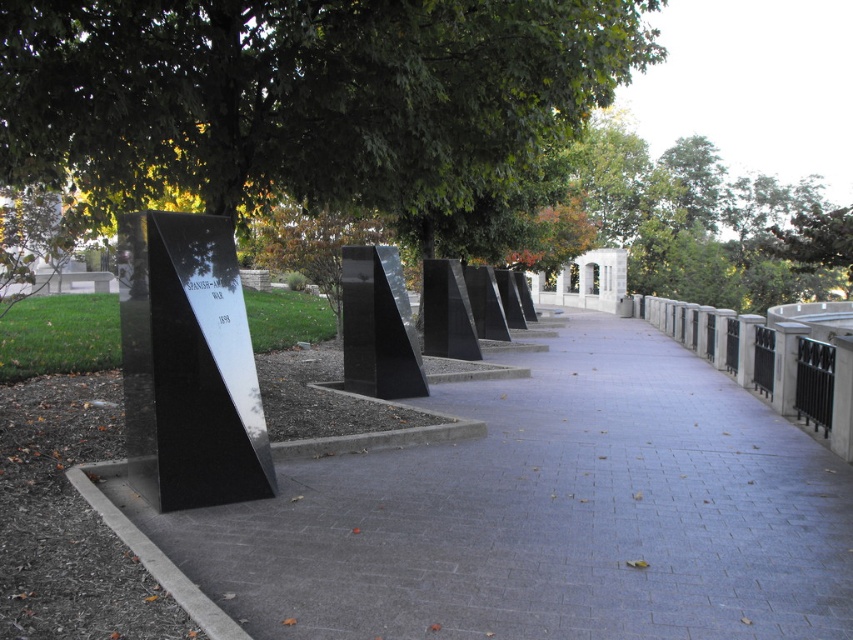
Question: Estimate the real-world distances between objects in this image. Which object is farther from the green leafy tree at upper center?

Choices:
 (A) black polished stone monument at center
 (B) gray concrete pavement at center

Answer: (B)

Question: Is gray concrete pavement at center closer to the viewer compared to green leafy tree at upper center?

Choices:
 (A) yes
 (B) no

Answer: (A)

Question: Can you confirm if gray concrete pavement at center is positioned above black polished stone monument at center?

Choices:
 (A) no
 (B) yes

Answer: (A)

Question: Among these points, which one is nearest to the camera?

Choices:
 (A) (384, 365)
 (B) (763, 474)

Answer: (B)

Question: Is gray concrete pavement at center further to camera compared to green leafy tree at upper center?

Choices:
 (A) yes
 (B) no

Answer: (B)

Question: Which of the following is the closest to the observer?

Choices:
 (A) (830, 593)
 (B) (328, 68)
 (C) (376, 369)

Answer: (A)